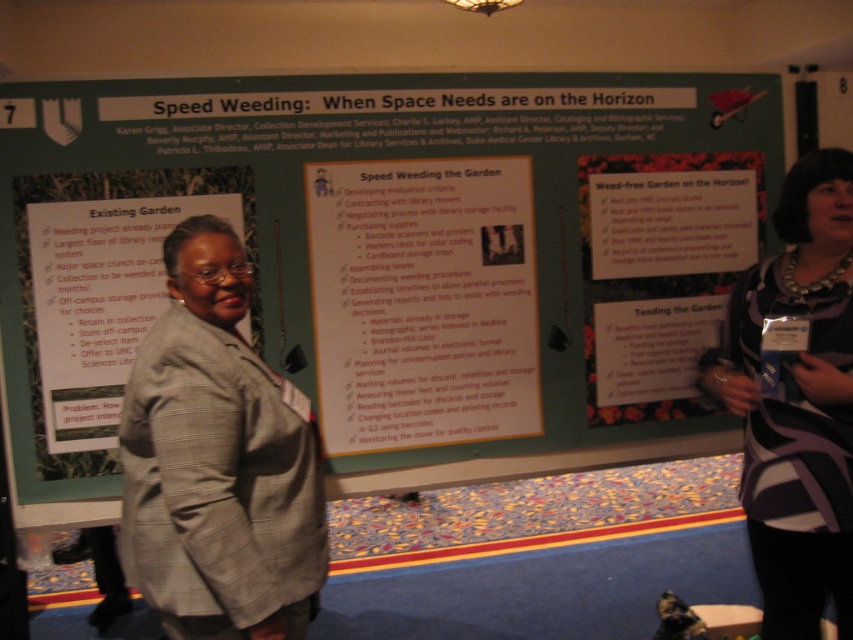
You are organizing a fashion show and need to display the gray plaid blazer at center and the striped fabric dress at center on adjacent mannequins. Given their widths, which garment requires more horizontal space between the mannequins?

The gray plaid blazer at center requires more horizontal space between the mannequins because its width surpasses that of the striped fabric dress at center.

You are organizing a library workshop and need to display two posters on a wall. The green matte poster at center and the white paper poster at center are both about weeding strategies. Since the wall space is limited, which poster should you place higher up to ensure both are visible without overlapping?

The green matte poster at center is taller than the white paper poster at center, so place the green matte poster at center higher up so that its full height is visible without overlapping the white paper poster at center.